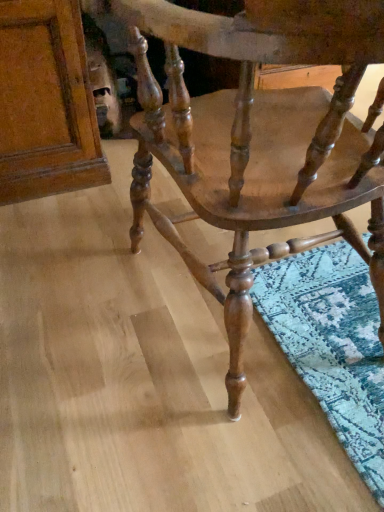
Question: Based on their positions, is matte wood cabinet at upper left located to the left or right of wooden chair at center?

Choices:
 (A) right
 (B) left

Answer: (B)

Question: Is matte wood cabinet at upper left taller or shorter than wooden chair at center?

Choices:
 (A) short
 (B) tall

Answer: (A)

Question: Is point (21, 182) positioned closer to the camera than point (372, 220)?

Choices:
 (A) farther
 (B) closer

Answer: (A)

Question: Is wooden chair at center situated inside matte wood cabinet at upper left or outside?

Choices:
 (A) outside
 (B) inside

Answer: (A)

Question: From their relative heights in the image, would you say wooden chair at center is taller or shorter than matte wood cabinet at upper left?

Choices:
 (A) tall
 (B) short

Answer: (A)

Question: From the image's perspective, is wooden chair at center positioned above or below matte wood cabinet at upper left?

Choices:
 (A) above
 (B) below

Answer: (B)

Question: Is wooden chair at center bigger or smaller than matte wood cabinet at upper left?

Choices:
 (A) big
 (B) small

Answer: (A)